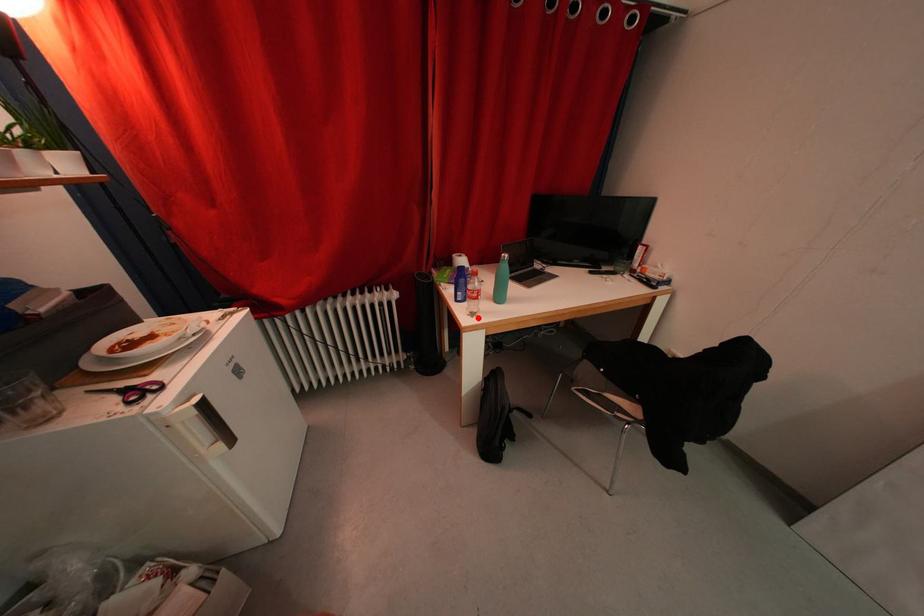
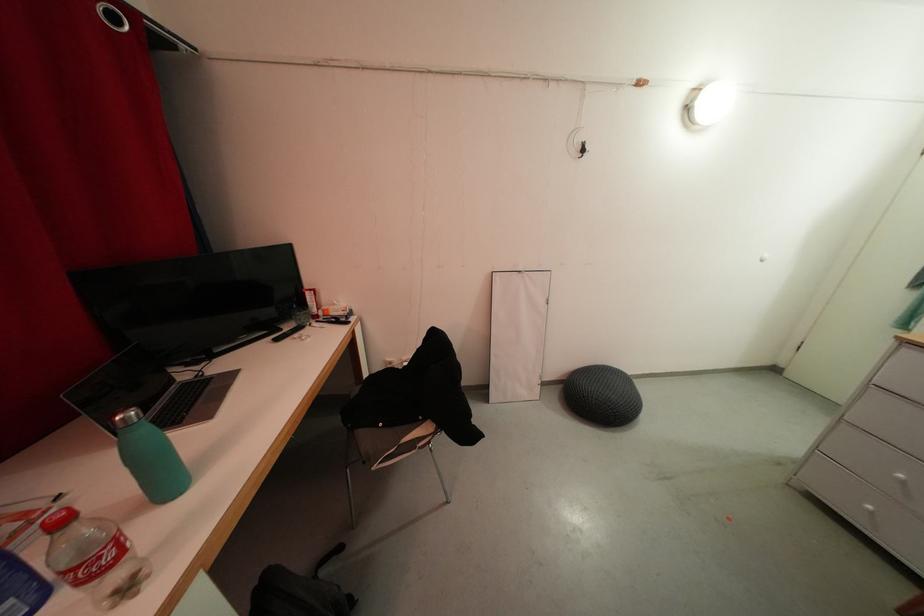
Question: A red point is marked in image1. In image2, is the corresponding 3D point closer to the camera or farther? Reply with the corresponding letter.

Choices:
 (A) The corresponding 3D point is closer.
 (B) The corresponding 3D point is farther.

Answer: (A)